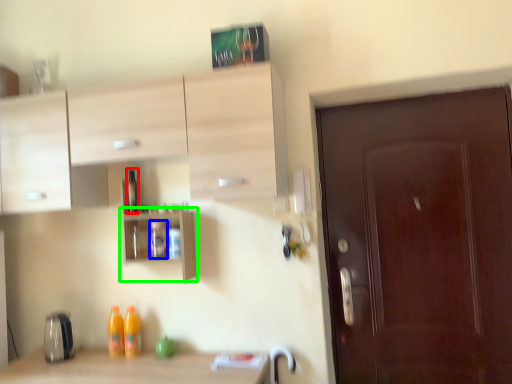
Question: Which object is the farthest from bottle (highlighted by a red box)? Choose among these: bottle (highlighted by a blue box) or shelf (highlighted by a green box).

Choices:
 (A) bottle
 (B) shelf

Answer: (A)